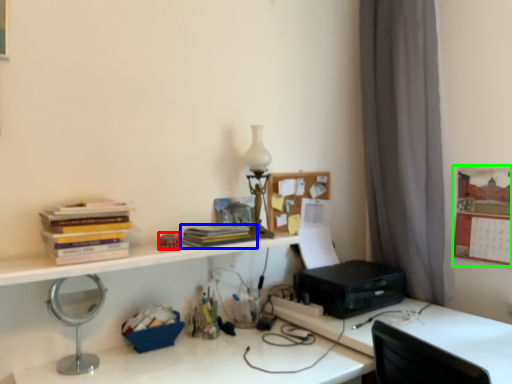
Question: Which object is the farthest from stationery (highlighted by a red box)? Choose among these: paperback book (highlighted by a blue box) or bulletin board (highlighted by a green box).

Choices:
 (A) paperback book
 (B) bulletin board

Answer: (B)